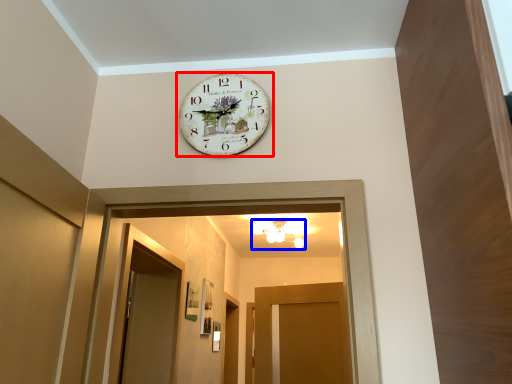
Question: Among these objects, which one is nearest to the camera, wall clock (highlighted by a red box) or light fixture (highlighted by a blue box)?

Choices:
 (A) wall clock
 (B) light fixture

Answer: (A)